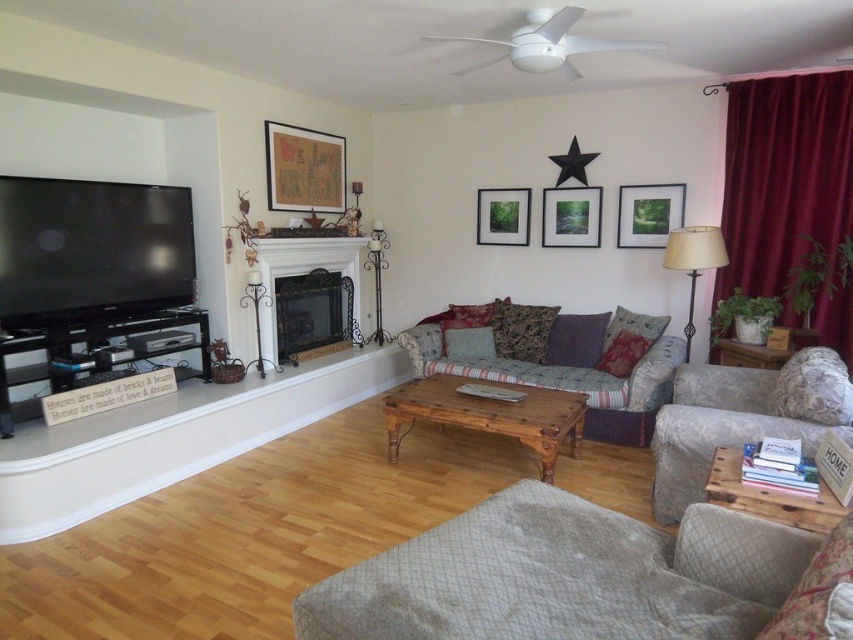
You are arranging flowers in the living room and need to place a vase between the brown wooden coffee table at center and the matte glass picture frame at center. According to the scene description, which object should the vase be placed to the left of?

The vase should be placed to the left of the matte glass picture frame at center because the brown wooden coffee table at center is located to its left side.

You are planning to place a new rectangular side table next to the floral fabric armchair at right. The side table you have is the same size as the brown wooden coffee table at center. Will the side table fit comfortably next to the armchair?

The floral fabric armchair at right is bigger than the brown wooden coffee table at center. Since the side table is the same size as the brown wooden coffee table at center, it should fit comfortably next to the armchair as the armchair is larger and provides enough space.